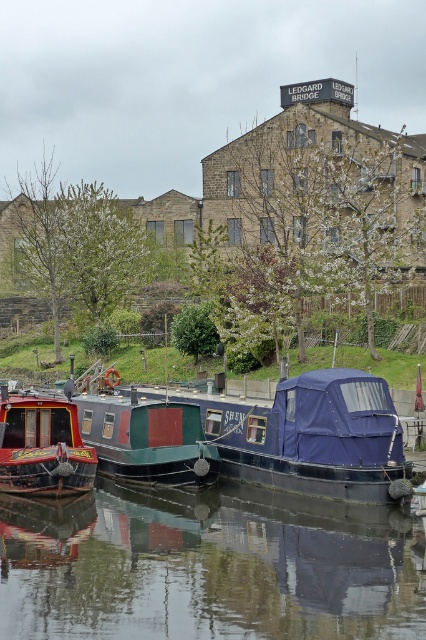
You are planning to load a cargo container that is 10 meters wide onto the blue tarpaulin boat at center and the green matte boat at center. Based on their sizes, which boat can accommodate the cargo container?

The blue tarpaulin boat at center has a larger width than the green matte boat at center, so the cargo container can be placed on the blue tarpaulin boat at center.